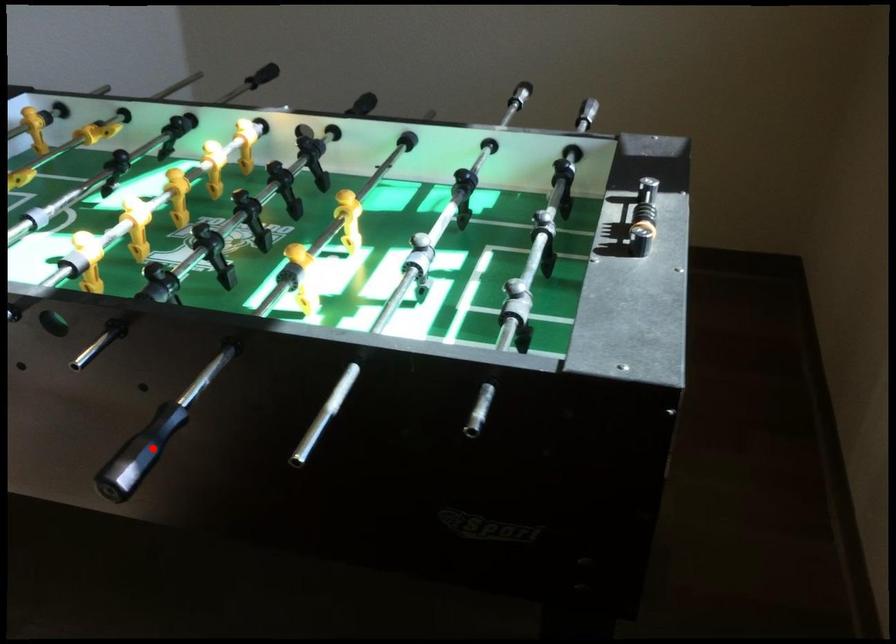
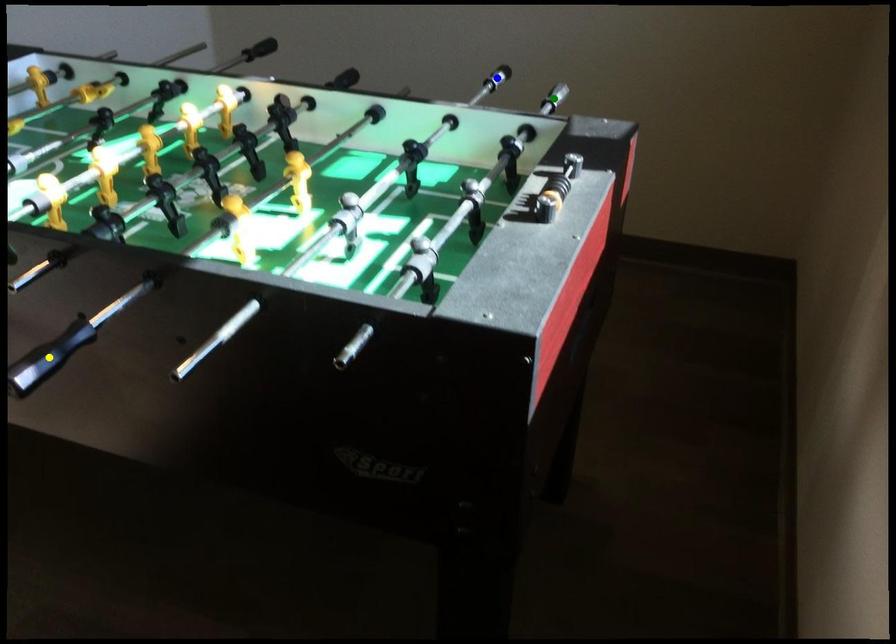
Question: I am providing you with two images of the same scene from different viewpoints. A red point is marked on the first image. You are given multiple points on the second image. Which mark in image 2 goes with the point in image 1?

Choices:
 (A) yellow point
 (B) green point
 (C) blue point

Answer: (A)